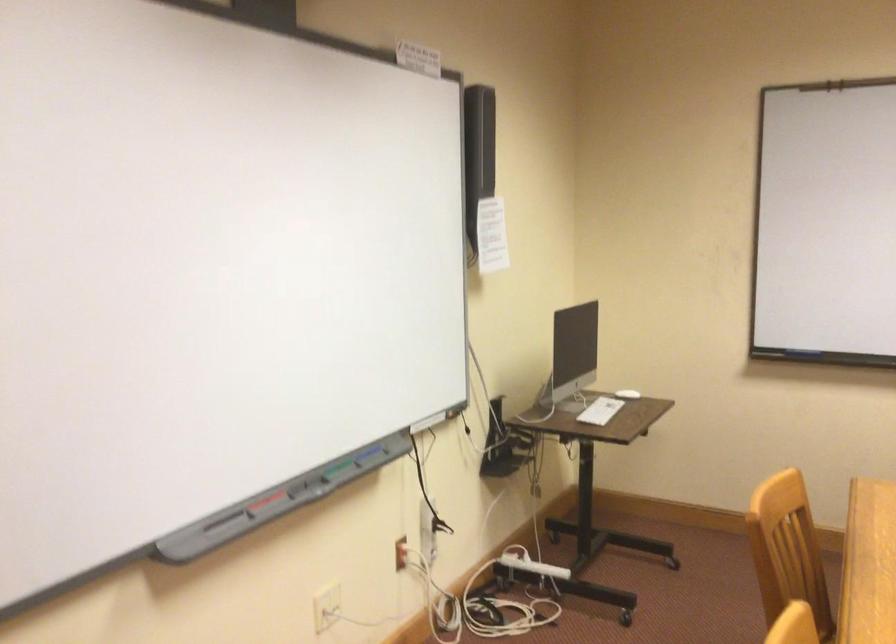
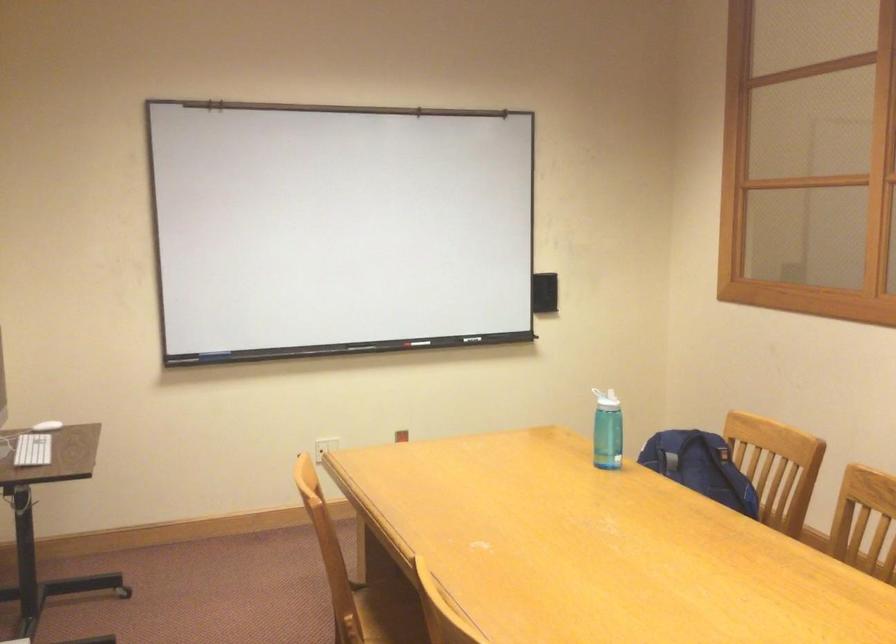
In the second image, find the point that corresponds to [613,408] in the first image.

(32, 450)